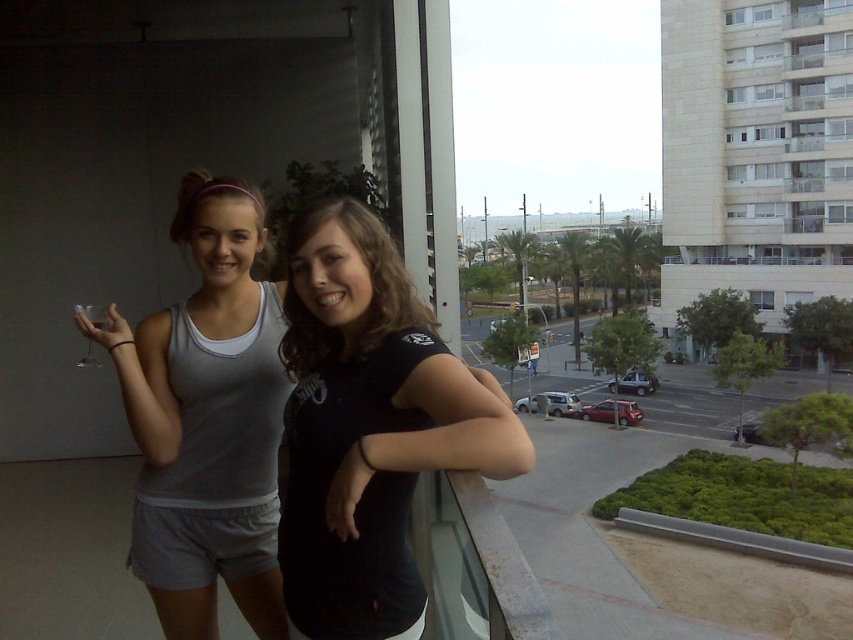
You are standing on the balcony and want to reach the point at coordinates [312,502] without moving your feet. Can you stretch your arm to touch it?

The point at coordinates [312,502] is 1.52 meters away from the viewer. If your arm length is at least 1.52 meters, you can reach it. Otherwise, you cannot.